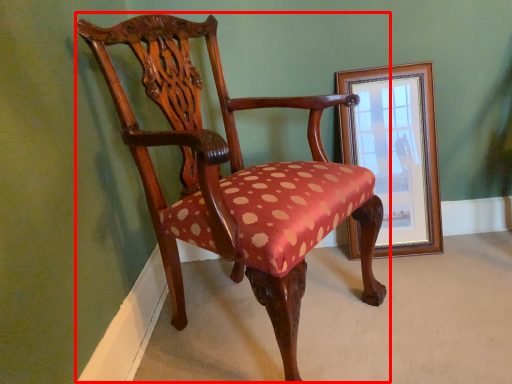
Question: Where is chair (annotated by the red box) located in relation to picture frame in the image?

Choices:
 (A) left
 (B) right

Answer: (A)